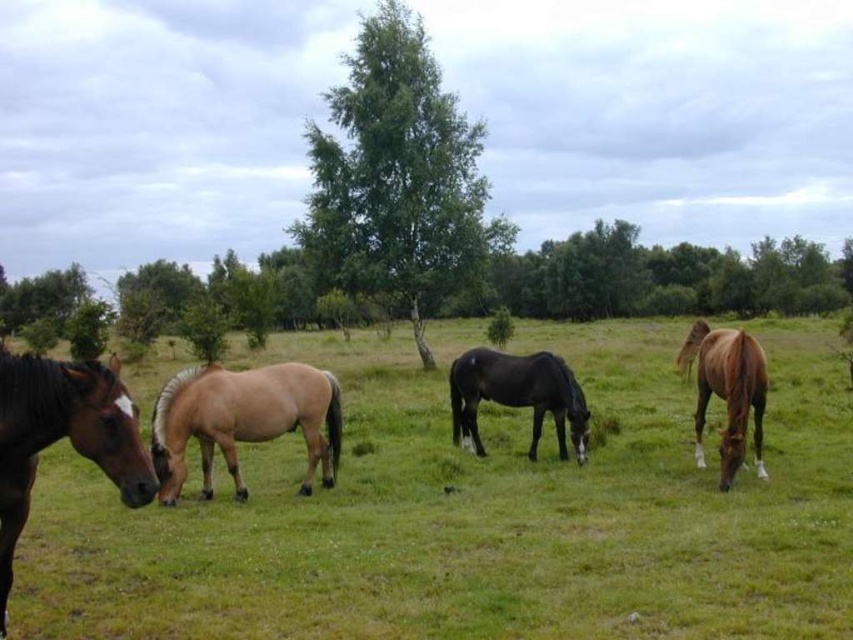
You are standing in the field and see the brown glossy horse at left and the green grass pasture at lower left. Which object is closer to you?

The green grass pasture at lower left is closer to you because the brown glossy horse at left is behind it.